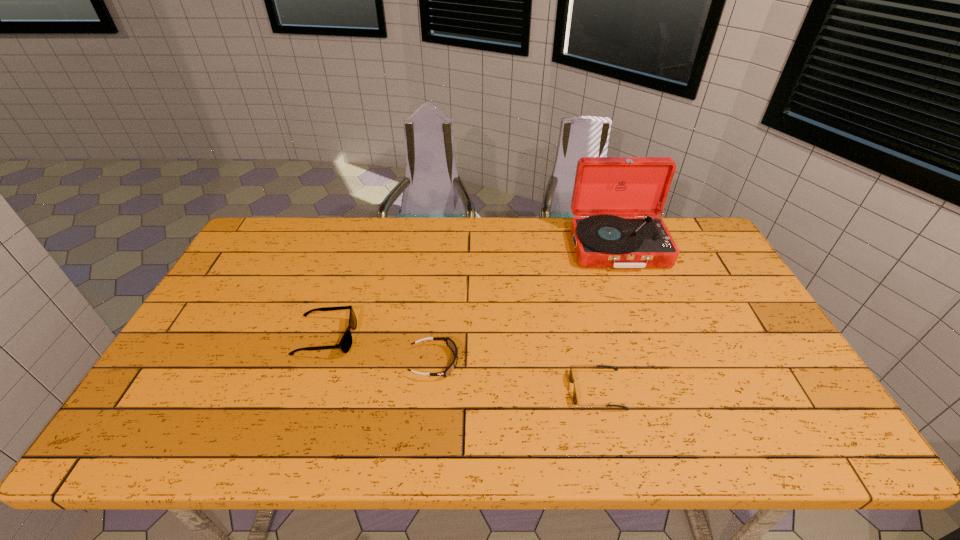
Locate an element on the screen. The image size is (960, 540). vacant region located 0.200m on the front-facing side of the shorter sunglasses is located at coordinates (489, 390).

Image resolution: width=960 pixels, height=540 pixels. I want to click on vacant space situated on the front-facing side of the shorter sunglasses, so click(x=440, y=390).

The height and width of the screenshot is (540, 960). In order to click on free space located on the front-facing side of the shorter sunglasses in this screenshot , I will do [x=456, y=390].

Locate an element on the screen. The width and height of the screenshot is (960, 540). object located at the far edge is located at coordinates (605, 187).

What are the coordinates of `blank space at the far edge of the desktop` in the screenshot? It's located at (575, 260).

Identify the location of vacant space at the near edge of the desktop. Image resolution: width=960 pixels, height=540 pixels. (568, 424).

Image resolution: width=960 pixels, height=540 pixels. Identify the location of free space at the left edge of the desktop. (196, 329).

The width and height of the screenshot is (960, 540). In order to click on free region at the right edge of the desktop in this screenshot , I will do `click(731, 368)`.

In the image, there is a desktop. What are the coordinates of `free space at the far left corner` in the screenshot? It's located at (270, 243).

Where is `blank area at the near left corner`? The width and height of the screenshot is (960, 540). blank area at the near left corner is located at coordinates (173, 450).